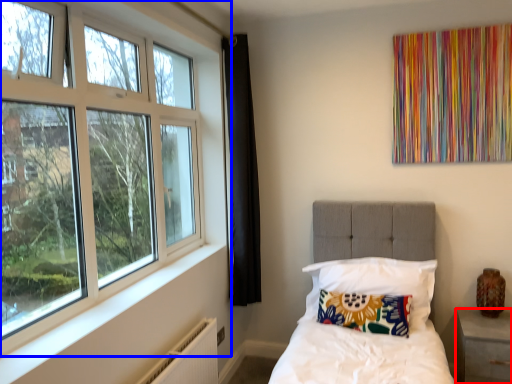
Question: Which point is further to the camera, nightstand (highlighted by a red box) or window (highlighted by a blue box)?

Choices:
 (A) nightstand
 (B) window

Answer: (A)